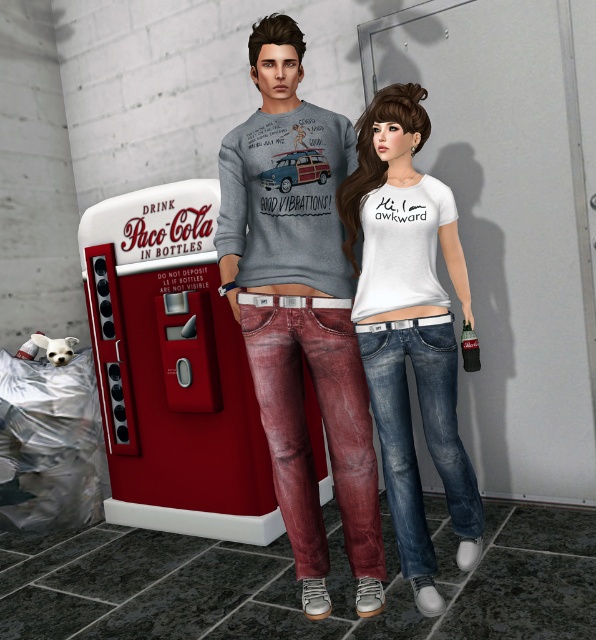
Locate an element on the screen. The image size is (596, 640). matte gray sweatshirt at center is located at coordinates (342, 336).

Between point (237, 179) and point (454, 339), which one is positioned in front?

Point (237, 179)

Locate an element on the screen. This screenshot has width=596, height=640. matte gray sweatshirt at center is located at coordinates (342, 336).

From the picture: Does matte gray sweatshirt at center have a lesser width compared to metallic red vending machine at center?

Indeed, matte gray sweatshirt at center has a lesser width compared to metallic red vending machine at center.

Which is above, matte gray sweatshirt at center or metallic red vending machine at center?

Positioned higher is matte gray sweatshirt at center.

The width and height of the screenshot is (596, 640). Identify the location of matte gray sweatshirt at center. (342, 336).

Find the location of `matte gray sweatshirt at center`. matte gray sweatshirt at center is located at coordinates (342, 336).

Between metallic red vending machine at center and white matte t-shirt at center, which one has less height?

Standing shorter between the two is metallic red vending machine at center.

Measure the distance between metallic red vending machine at center and camera.

12.24 feet

The height and width of the screenshot is (640, 596). What are the coordinates of `metallic red vending machine at center` in the screenshot? It's located at (172, 369).